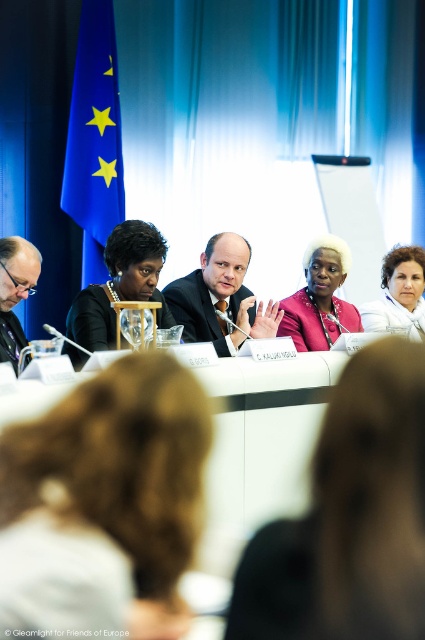
From the picture: Does pink fabric at center have a lesser height compared to matte black glasses at left?

Correct, pink fabric at center is not as tall as matte black glasses at left.

Is point (399, 476) behind point (2, 268)?

No.

At what (x,y) coordinates should I click in order to perform the action: click on pink fabric at center. Please return your answer as a coordinate pair (x, y). The image size is (425, 640). Looking at the image, I should click on (350, 516).

Is point (237, 296) more distant than point (34, 282)?

Yes.

Does smooth black suit at center have a greater width compared to matte black glasses at left?

Correct, the width of smooth black suit at center exceeds that of matte black glasses at left.

Describe the element at coordinates (221, 298) in the screenshot. Image resolution: width=425 pixels, height=640 pixels. I see `smooth black suit at center` at that location.

Identify the location of smooth black suit at center. Image resolution: width=425 pixels, height=640 pixels. coord(221,298).

Which is behind, point (391, 612) or point (241, 292)?

Positioned behind is point (241, 292).

Based on the photo, does pink fabric at center have a greater width compared to smooth black suit at center?

No.

Measure the distance between point (416, 557) and camera.

Point (416, 557) and camera are 33.92 inches apart from each other.

The image size is (425, 640). Find the location of `pink fabric at center`. pink fabric at center is located at coordinates (350, 516).